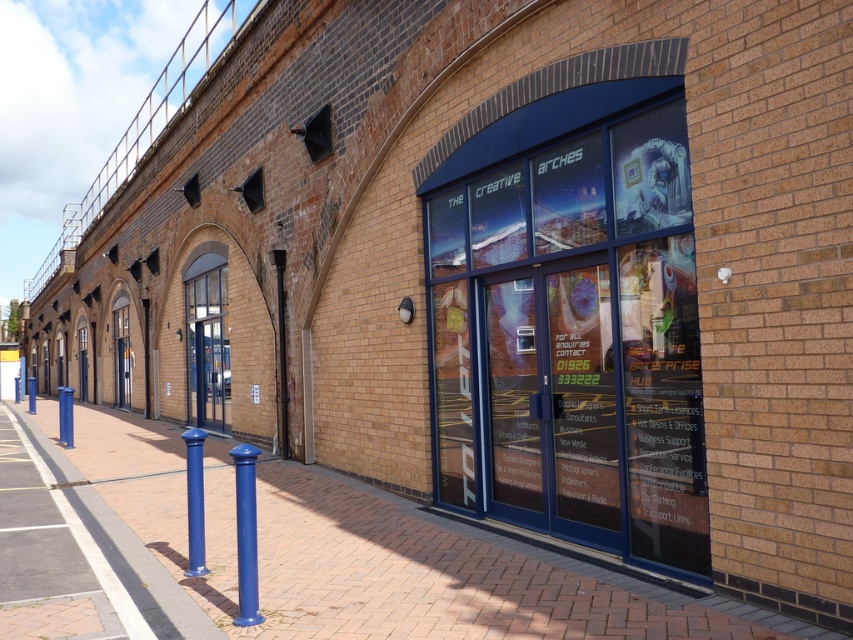
Question: Can you confirm if transparent glass storefront at center is positioned below blue matte pole at center?

Choices:
 (A) no
 (B) yes

Answer: (A)

Question: Can you confirm if transparent glass storefront at center is thinner than brick pavement at center?

Choices:
 (A) no
 (B) yes

Answer: (B)

Question: Which of the following is the farthest from the observer?

Choices:
 (A) blue matte pole at center
 (B) blue metallic pole at left
 (C) transparent glass storefront at center

Answer: (B)

Question: Does brick pavement at center have a lesser width compared to matte blue bollard at center?

Choices:
 (A) no
 (B) yes

Answer: (A)

Question: Estimate the real-world distances between objects in this image. Which object is farther from the brick pavement at center?

Choices:
 (A) transparent glass storefront at center
 (B) blue matte pole at center
 (C) matte blue bollard at center

Answer: (B)

Question: Which is farther from the blue metallic pole at left?

Choices:
 (A) blue matte pole at center
 (B) transparent glass storefront at center
 (C) matte blue bollard at center
 (D) brick pavement at center

Answer: (B)